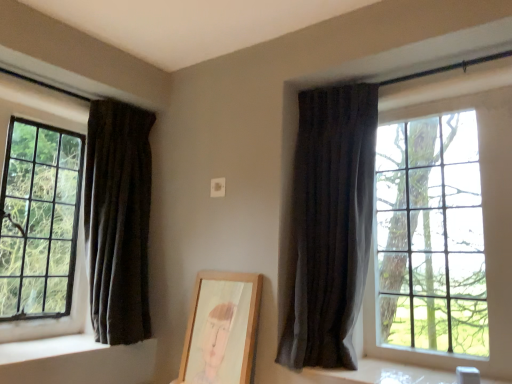
Question: From a real-world perspective, is dark fabric curtain at left, which is the second curtain in right-to-left order, positioned above or below dark fabric curtain at right, which appears as the 1th curtain when viewed from the right?

Choices:
 (A) below
 (B) above

Answer: (B)

Question: Visually, is dark fabric curtain at left, arranged as the 1th curtain when viewed from the left, positioned to the left or to the right of dark fabric curtain at right, which appears as the 1th curtain when viewed from the right?

Choices:
 (A) left
 (B) right

Answer: (A)

Question: Which object is positioned farthest from the dark fabric curtain at right, marked as the second curtain in a left-to-right arrangement?

Choices:
 (A) matte black window at left, which ranks as the 1th window in left-to-right order
 (B) clear glass window at right, the 2th window from the left
 (C) white smooth window sill at lower left, which is the first window sill in left-to-right order
 (D) white smooth window sill at lower right, positioned as the second window sill in left-to-right order
 (E) wooden picture frame at center

Answer: (A)

Question: Which of these objects is positioned closest to the white smooth window sill at lower right, the first window sill positioned from the right?

Choices:
 (A) wooden picture frame at center
 (B) dark fabric curtain at right, marked as the second curtain in a left-to-right arrangement
 (C) clear glass window at right, the 2th window from the left
 (D) white smooth window sill at lower left, which is the first window sill in left-to-right order
 (E) matte black window at left, placed as the second window when sorted from right to left

Answer: (C)